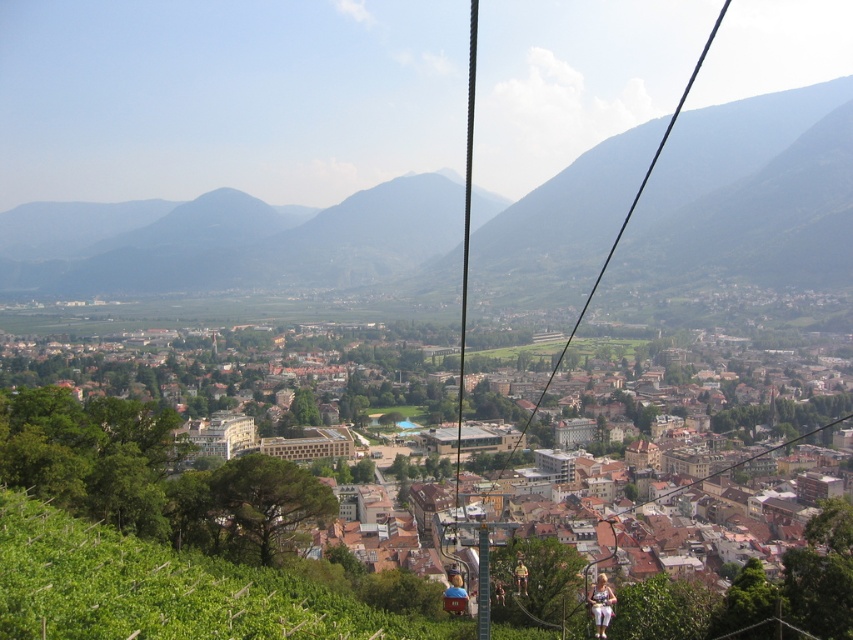
Is point (274, 593) positioned before point (521, 588)?

Yes, it is.

Is brown wooden buildings at center bigger than yellow fabric jacket at lower right?

Yes, brown wooden buildings at center is bigger than yellow fabric jacket at lower right.

Does point (119, 406) lie in front of point (519, 566)?

No, it is not.

Image resolution: width=853 pixels, height=640 pixels. I want to click on brown wooden buildings at center, so click(x=364, y=545).

From the picture: Is metallic cable car at center wider than white fabric pants at lower center?

Yes, metallic cable car at center is wider than white fabric pants at lower center.

Which is above, metallic cable car at center or white fabric pants at lower center?

metallic cable car at center is above.

This screenshot has width=853, height=640. Identify the location of metallic cable car at center. (467, 193).

Is metallic cable car at center wider than yellow fabric jacket at lower right?

Correct, the width of metallic cable car at center exceeds that of yellow fabric jacket at lower right.

Is metallic cable car at center above yellow fabric jacket at lower right?

Correct, metallic cable car at center is located above yellow fabric jacket at lower right.

Which is in front, point (471, 150) or point (523, 577)?

Point (523, 577) is in front.

I want to click on metallic cable car at center, so click(467, 193).